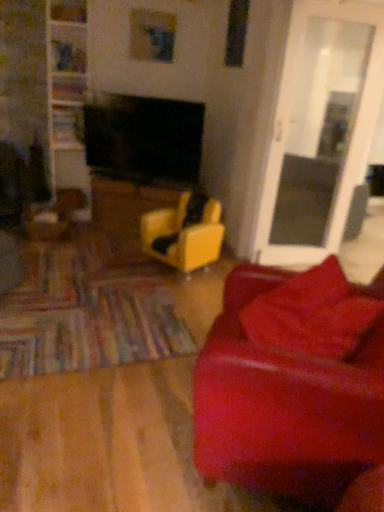
In order to click on free space to the left of leather couch at right in this screenshot , I will do `click(120, 428)`.